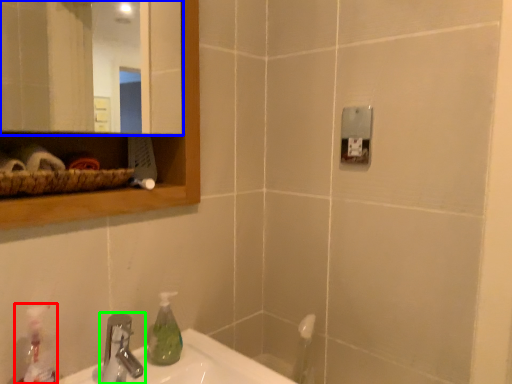
Question: Which is farther away from cleaning product (highlighted by a red box)? mirror (highlighted by a blue box) or tap (highlighted by a green box)?

Choices:
 (A) mirror
 (B) tap

Answer: (A)